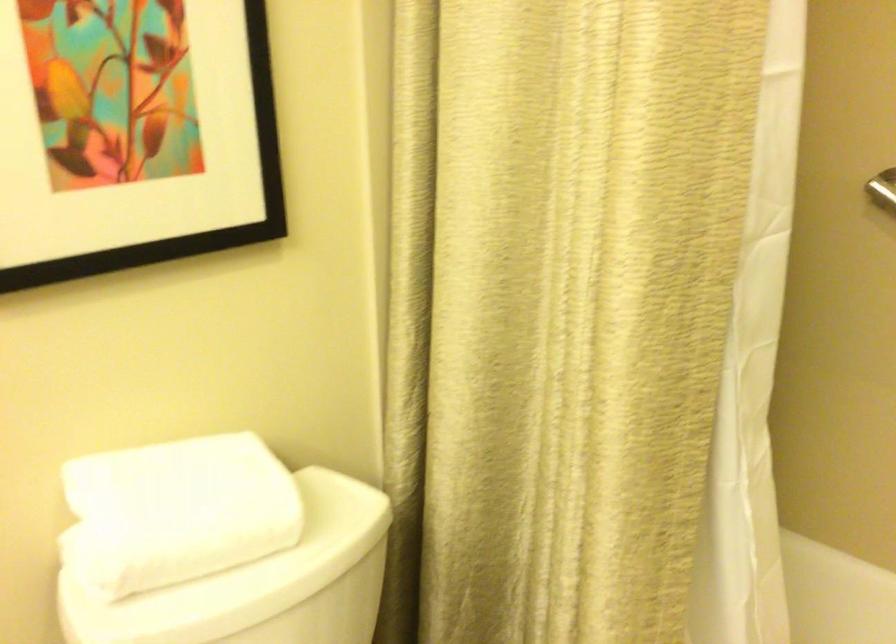
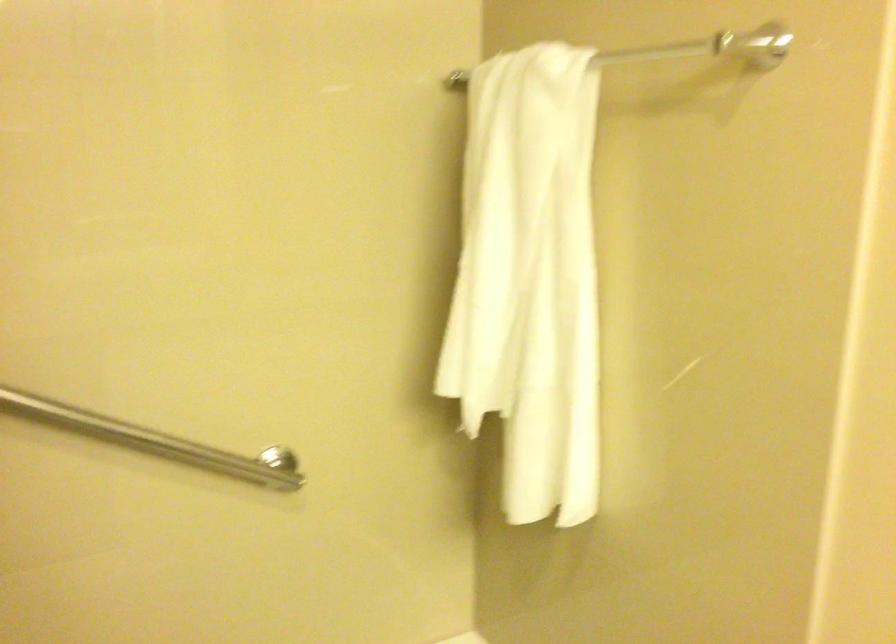
Question: The camera is either moving clockwise (left) or counter-clockwise (right) around the object. The first image is from the beginning of the video and the second image is from the end. Is the camera moving left or right when shooting the video?

Choices:
 (A) Left
 (B) Right

Answer: (A)